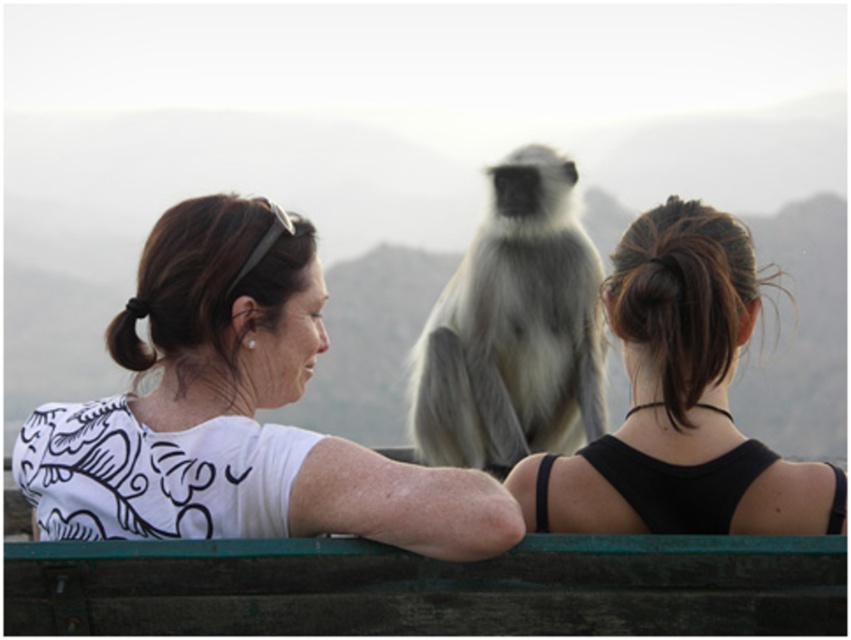
You are a photographer trying to take a picture of the gray furry monkey at center. You are standing behind the green wooden rail at lower center. Which side of the monkey should you aim your camera towards to capture it in the frame?

The green wooden rail at lower center is positioned on the left side of gray furry monkey at center, so you should aim your camera towards the right side of the monkey to capture it in the frame.

You are a photographer trying to capture a photo of the monkey. You notice the white printed shirt at left and the green wooden rail at lower center in your frame. Which object should you move closer to the center to ensure the monkey is the main focus?

The white printed shirt at left is positioned on the left side of the green wooden rail at lower center. To make the monkey the main focus, you should move the green wooden rail at lower center closer to the center of the frame, as it is closer to the monkey and the shirt is further left.

You are standing at the center of the scene and want to walk towards the green wooden rail at lower center. What direction should you move in?

You should move towards the lower center direction to reach the green wooden rail at lower center.